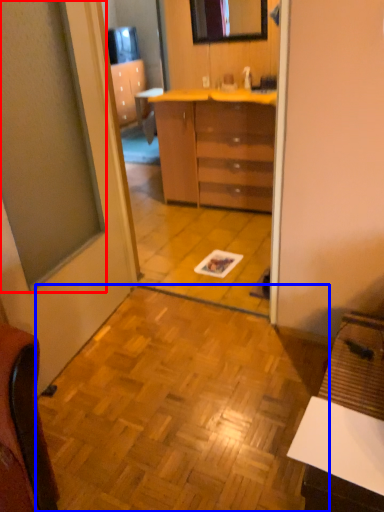
Question: Among these objects, which one is nearest to the camera, window (highlighted by a red box) or tile (highlighted by a blue box)?

Choices:
 (A) window
 (B) tile

Answer: (A)